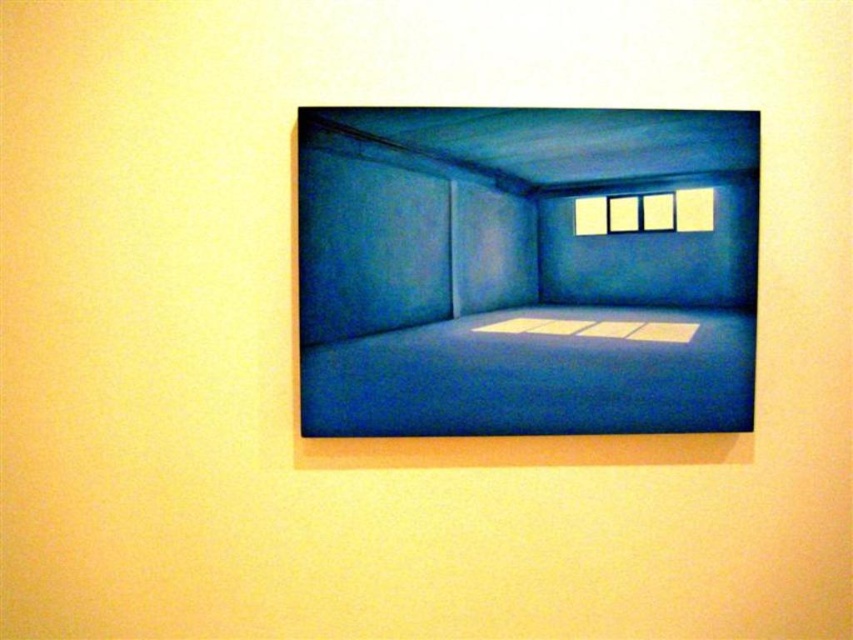
Question: Which of the following is the farthest from the observer?

Choices:
 (A) blue matte room at center
 (B) white matte window at upper center

Answer: (B)

Question: Which point is farther to the camera?

Choices:
 (A) (349, 412)
 (B) (653, 227)

Answer: (B)

Question: Which point is closer to the camera?

Choices:
 (A) (519, 179)
 (B) (579, 224)

Answer: (A)

Question: Does blue matte room at center appear on the right side of white matte window at upper center?

Choices:
 (A) no
 (B) yes

Answer: (A)

Question: Is blue matte room at center further to the viewer compared to white matte window at upper center?

Choices:
 (A) no
 (B) yes

Answer: (A)

Question: Is blue matte room at center below white matte window at upper center?

Choices:
 (A) yes
 (B) no

Answer: (A)